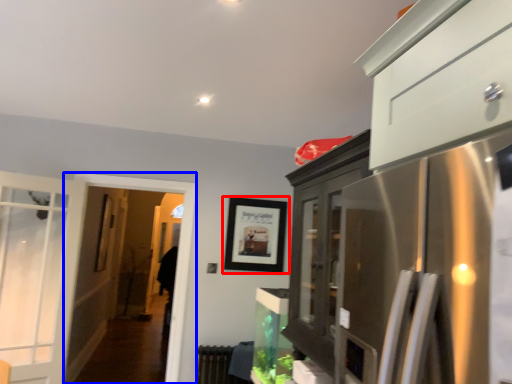
Question: Among these objects, which one is nearest to the camera, picture frame (highlighted by a red box) or screen door (highlighted by a blue box)?

Choices:
 (A) picture frame
 (B) screen door

Answer: (B)